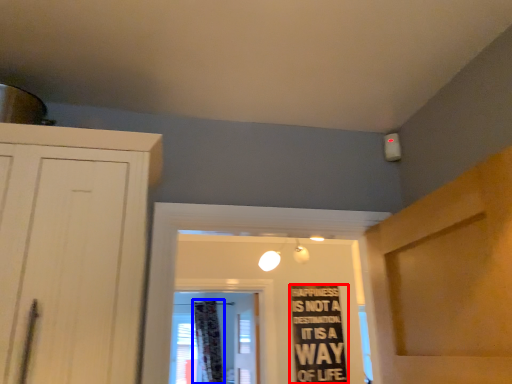
Question: Among these objects, which one is nearest to the camera, bulletin board (highlighted by a red box) or curtain (highlighted by a blue box)?

Choices:
 (A) bulletin board
 (B) curtain

Answer: (A)